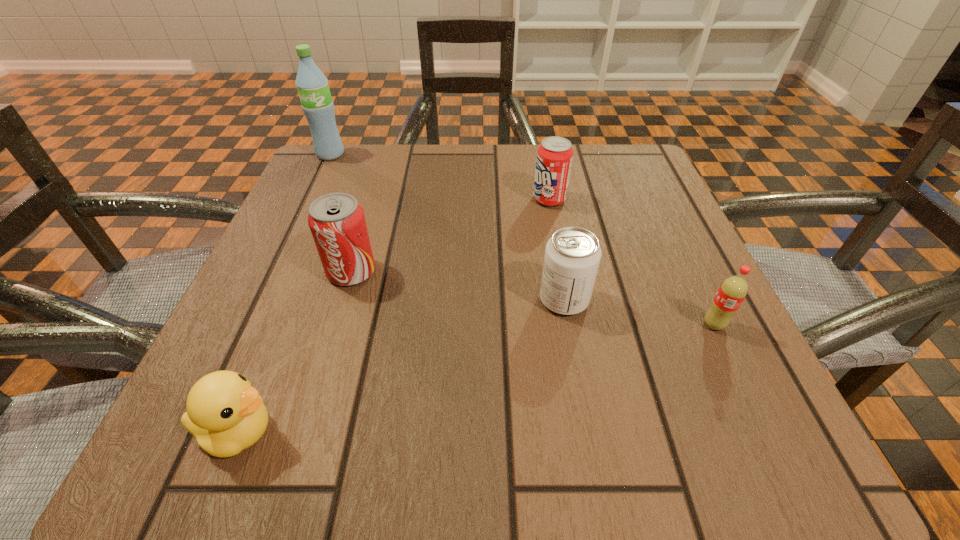
Where is `vacant position located 0.170m on the surface of the second farthest object`? This screenshot has width=960, height=540. vacant position located 0.170m on the surface of the second farthest object is located at coordinates (448, 199).

At what (x,y) coordinates should I click in order to perform the action: click on free spot located on the left of the rightmost object. Please return your answer as a coordinate pair (x, y). The image size is (960, 540). Looking at the image, I should click on (481, 325).

Find the location of `vacant space located 0.230m on the face of the nearest object`. vacant space located 0.230m on the face of the nearest object is located at coordinates (469, 432).

Where is `water bottle situated at the far edge`? The height and width of the screenshot is (540, 960). water bottle situated at the far edge is located at coordinates (312, 85).

Identify the location of soda can that is at the far edge. This screenshot has height=540, width=960. (554, 157).

Where is `object that is at the near edge`? The height and width of the screenshot is (540, 960). object that is at the near edge is located at coordinates (225, 413).

This screenshot has height=540, width=960. What are the coordinates of `water bottle that is at the left edge` in the screenshot? It's located at (312, 85).

Where is `soda can that is at the left edge`? The image size is (960, 540). soda can that is at the left edge is located at coordinates (337, 222).

The height and width of the screenshot is (540, 960). What are the coordinates of `duck present at the left edge` in the screenshot? It's located at (225, 413).

Where is `object present at the right edge`? object present at the right edge is located at coordinates (733, 290).